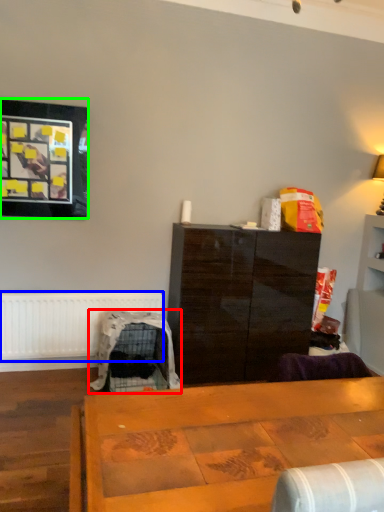
Question: Which object is the farthest from swivel chair (highlighted by a red box)? Choose among these: radiator (highlighted by a blue box) or picture frame (highlighted by a green box).

Choices:
 (A) radiator
 (B) picture frame

Answer: (B)